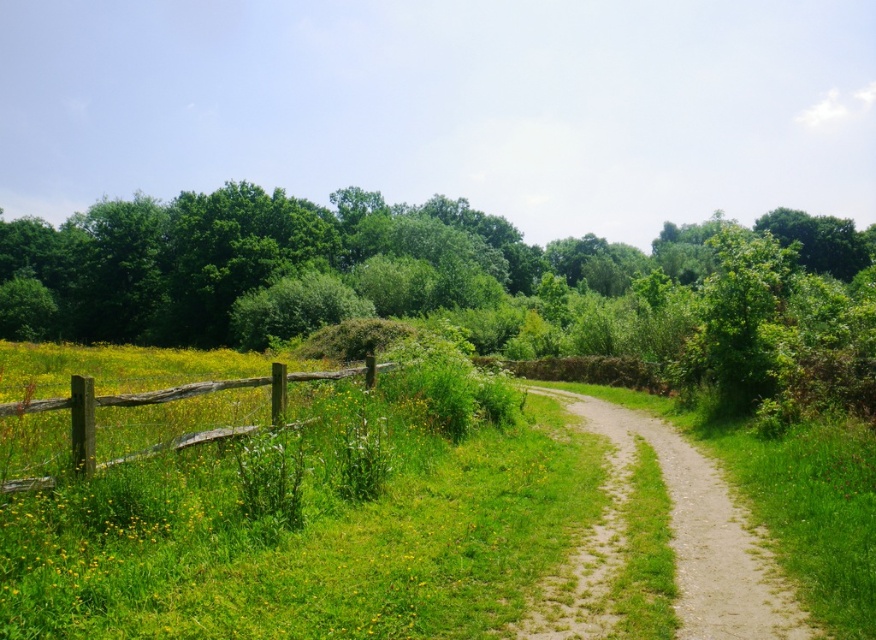
You are standing at the starting point of the dirt path and want to walk towards the green leafy tree at center. Will you pass by the weathered wood fence at left before reaching the tree?

The green leafy tree at center is 358.02 feet away from the weathered wood fence at left. Since you are walking towards the tree, you will first pass by the weathered wood fence at left before reaching the tree because the fence is closer to your starting position than the tree is.